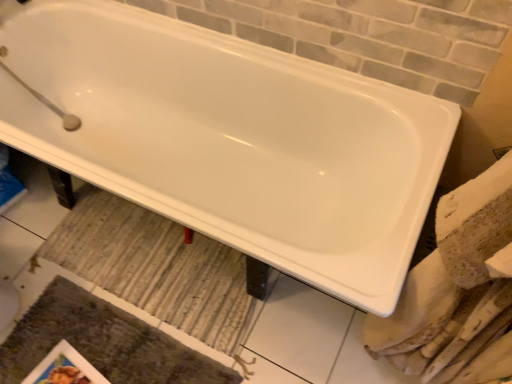
Question: Is matte paper magazine at lower left facing towards striped fabric bath mat at center, the second bath mat positioned from the bottom?

Choices:
 (A) no
 (B) yes

Answer: (A)

Question: From the image's perspective, is matte paper magazine at lower left below striped fabric bath mat at center, the second bath mat positioned from the bottom?

Choices:
 (A) no
 (B) yes

Answer: (B)

Question: Considering the relative sizes of matte paper magazine at lower left and striped fabric bath mat at center, the second bath mat positioned from the bottom, in the image provided, is matte paper magazine at lower left shorter than striped fabric bath mat at center, the second bath mat positioned from the bottom,?

Choices:
 (A) no
 (B) yes

Answer: (B)

Question: Is matte paper magazine at lower left not inside striped fabric bath mat at center, the second bath mat positioned from the bottom?

Choices:
 (A) no
 (B) yes

Answer: (B)

Question: Does matte paper magazine at lower left have a larger size compared to striped fabric bath mat at center, the 1th bath mat when ordered from top to bottom?

Choices:
 (A) no
 (B) yes

Answer: (A)

Question: Is matte paper magazine at lower left facing away from striped fabric bath mat at center, the 1th bath mat when ordered from top to bottom?

Choices:
 (A) no
 (B) yes

Answer: (A)

Question: Considering the relative sizes of textured gray bath mat at lower left, placed as the 2th bath mat when sorted from top to bottom, and striped fabric bath mat at center, the 1th bath mat when ordered from top to bottom, in the image provided, is textured gray bath mat at lower left, placed as the 2th bath mat when sorted from top to bottom, taller than striped fabric bath mat at center, the 1th bath mat when ordered from top to bottom,?

Choices:
 (A) yes
 (B) no

Answer: (A)

Question: From the image's perspective, is textured gray bath mat at lower left, placed as the 2th bath mat when sorted from top to bottom, over striped fabric bath mat at center, the 1th bath mat when ordered from top to bottom?

Choices:
 (A) yes
 (B) no

Answer: (B)

Question: Is textured gray bath mat at lower left, placed as the 2th bath mat when sorted from top to bottom, oriented towards striped fabric bath mat at center, the second bath mat positioned from the bottom?

Choices:
 (A) yes
 (B) no

Answer: (B)

Question: Is striped fabric bath mat at center, the second bath mat positioned from the bottom, a part of textured gray bath mat at lower left, which is the 1th bath mat in bottom-to-top order?

Choices:
 (A) yes
 (B) no

Answer: (B)

Question: Does textured gray bath mat at lower left, placed as the 2th bath mat when sorted from top to bottom, have a lesser width compared to striped fabric bath mat at center, the 1th bath mat when ordered from top to bottom?

Choices:
 (A) yes
 (B) no

Answer: (B)

Question: Is textured gray bath mat at lower left, placed as the 2th bath mat when sorted from top to bottom, bigger than striped fabric bath mat at center, the 1th bath mat when ordered from top to bottom?

Choices:
 (A) yes
 (B) no

Answer: (A)

Question: Considering the relative positions of matte paper magazine at lower left and textured gray bath mat at lower left, placed as the 2th bath mat when sorted from top to bottom, in the image provided, is matte paper magazine at lower left to the right of textured gray bath mat at lower left, placed as the 2th bath mat when sorted from top to bottom, from the viewer's perspective?

Choices:
 (A) no
 (B) yes

Answer: (A)